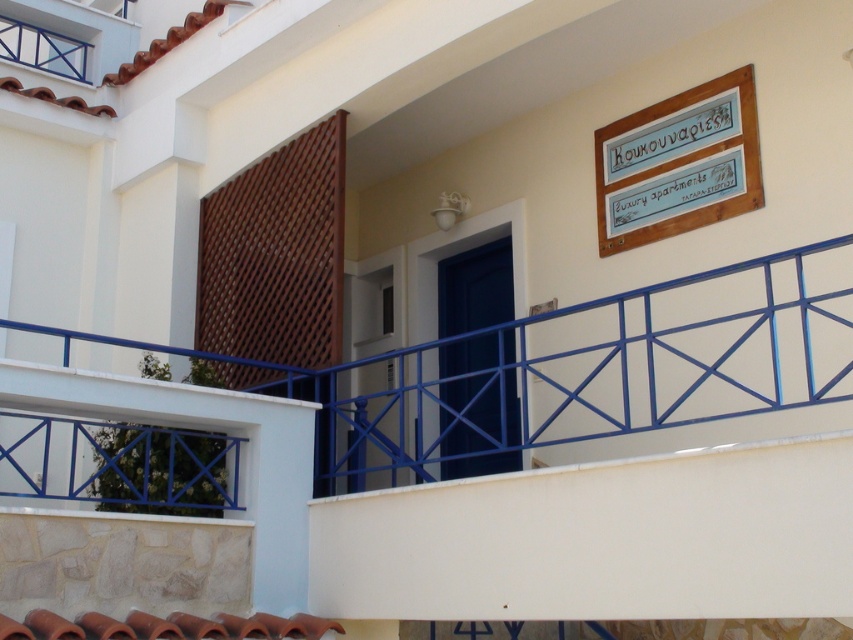
Question: Which is nearer to the wooden signboard at upper right?

Choices:
 (A) white painted metal railing at lower center
 (B) blue glossy door at center

Answer: (A)

Question: In this image, where is white painted metal railing at lower center located relative to blue glossy door at center?

Choices:
 (A) left
 (B) right

Answer: (B)

Question: Among these points, which one is farthest from the camera?

Choices:
 (A) (425, 371)
 (B) (442, 264)

Answer: (B)

Question: Is wooden signboard at upper right further to the viewer compared to blue glossy door at center?

Choices:
 (A) no
 (B) yes

Answer: (A)

Question: Among these points, which one is farthest from the camera?

Choices:
 (A) (729, 196)
 (B) (498, 324)
 (C) (519, 440)

Answer: (C)

Question: Is white painted metal railing at lower center bigger than wooden signboard at upper right?

Choices:
 (A) no
 (B) yes

Answer: (A)